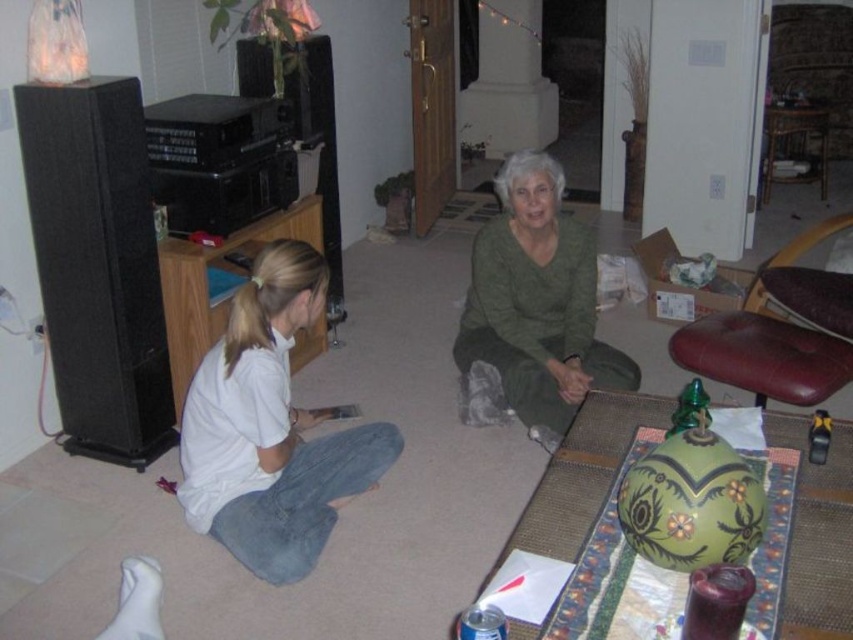
Can you confirm if white cotton shirt at lower left is positioned to the left of green matte sweater at center?

Indeed, white cotton shirt at lower left is positioned on the left side of green matte sweater at center.

Can you confirm if white cotton shirt at lower left is taller than green matte sweater at center?

Incorrect, white cotton shirt at lower left's height is not larger of green matte sweater at center's.

Image resolution: width=853 pixels, height=640 pixels. What do you see at coordinates (270, 428) in the screenshot?
I see `white cotton shirt at lower left` at bounding box center [270, 428].

The width and height of the screenshot is (853, 640). Find the location of `white cotton shirt at lower left`. white cotton shirt at lower left is located at coordinates (270, 428).

Is green matte sweater at center taller than leather seat at right?

Yes, green matte sweater at center is taller than leather seat at right.

Is point (576, 252) closer to viewer compared to point (798, 342)?

No, it is behind (798, 342).

Is point (576, 385) positioned before point (756, 285)?

Yes, point (576, 385) is closer to viewer.

Locate an element on the screen. This screenshot has width=853, height=640. green matte sweater at center is located at coordinates (537, 301).

Can you confirm if white cotton shirt at lower left is positioned to the left of leather seat at right?

Yes, white cotton shirt at lower left is to the left of leather seat at right.

Locate an element on the screen. white cotton shirt at lower left is located at coordinates (270, 428).